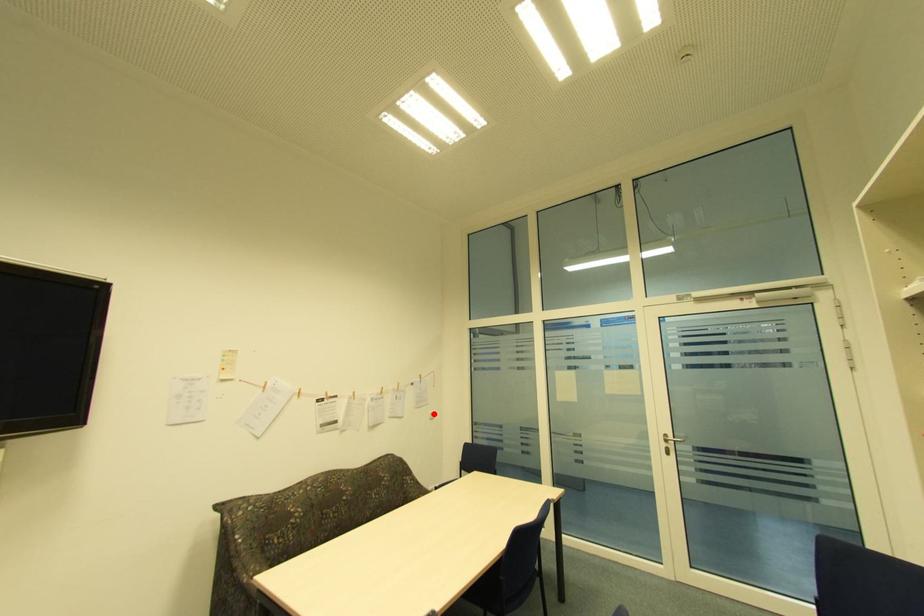
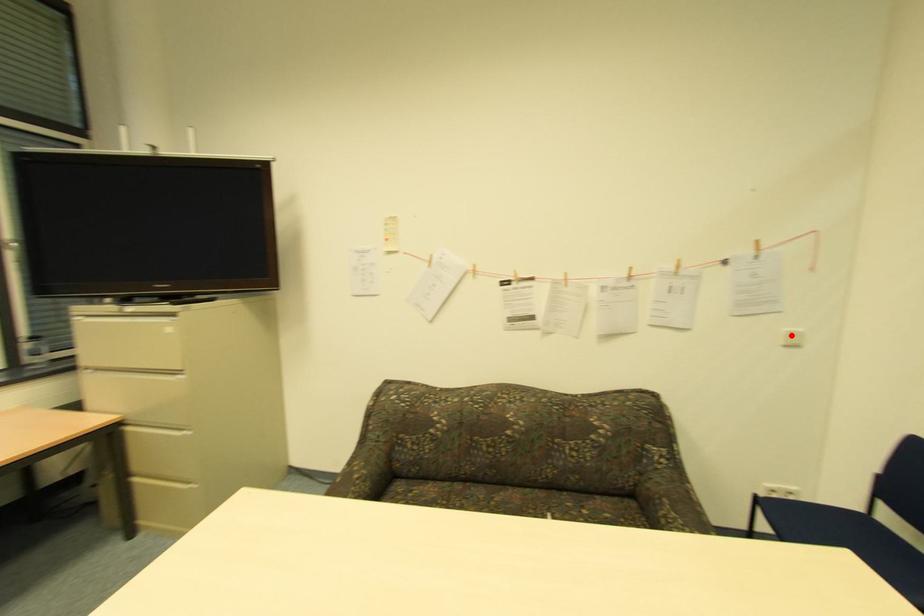
I am providing you with two images of the same scene from different viewpoints. A red point is marked on the first image and another point is marked on the second image. Does the point marked in image1 correspond to the same location as the one in image2?

Yes